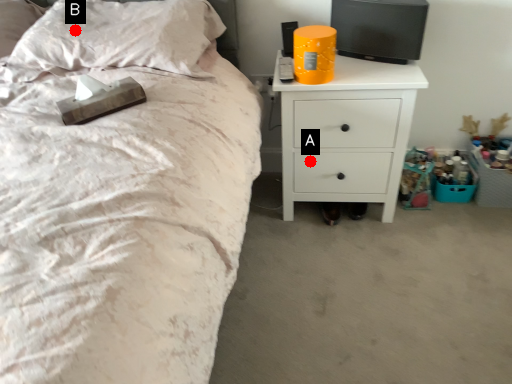
Question: Two points are circled on the image, labeled by A and B beside each circle. Which point is closer to the camera?

Choices:
 (A) A is closer
 (B) B is closer

Answer: (B)